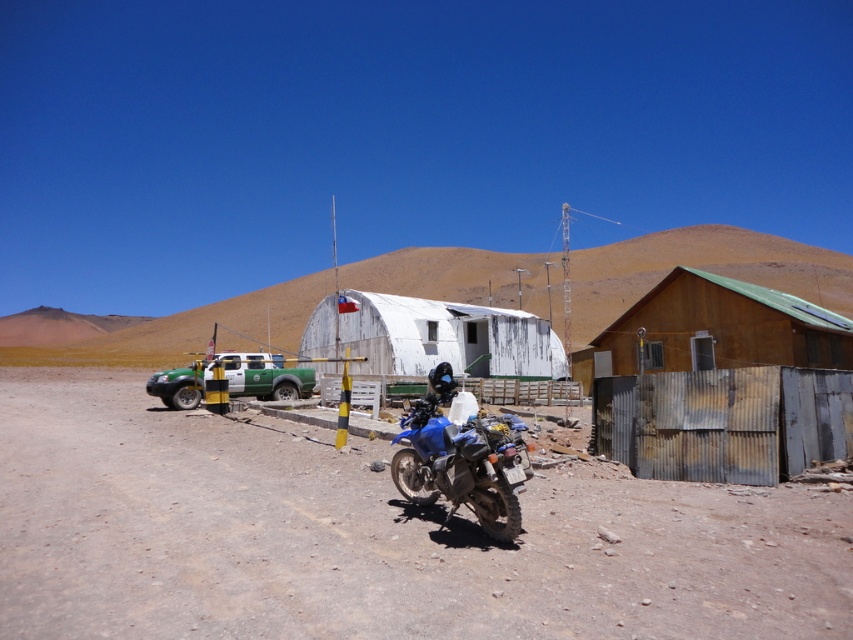
Question: Can you confirm if white corrugated metal building at center is wider than rusty corrugated hut at right?

Choices:
 (A) no
 (B) yes

Answer: (B)

Question: Estimate the real-world distances between objects in this image. Which object is farther from the green matte truck at center?

Choices:
 (A) rusty corrugated hut at right
 (B) blue matte motorcycle at center
 (C) white corrugated metal building at center

Answer: (C)

Question: Can you confirm if dusty gravel road at center is wider than rusty corrugated hut at right?

Choices:
 (A) no
 (B) yes

Answer: (B)

Question: Which point is closer to the camera?

Choices:
 (A) (271, 324)
 (B) (233, 372)

Answer: (B)

Question: Which point is farther to the camera?

Choices:
 (A) white weathered hut at center
 (B) dusty gravel road at center
 (C) blue matte motorcycle at center

Answer: (A)

Question: Is the position of white weathered hut at center more distant than that of green matte truck at center?

Choices:
 (A) no
 (B) yes

Answer: (B)